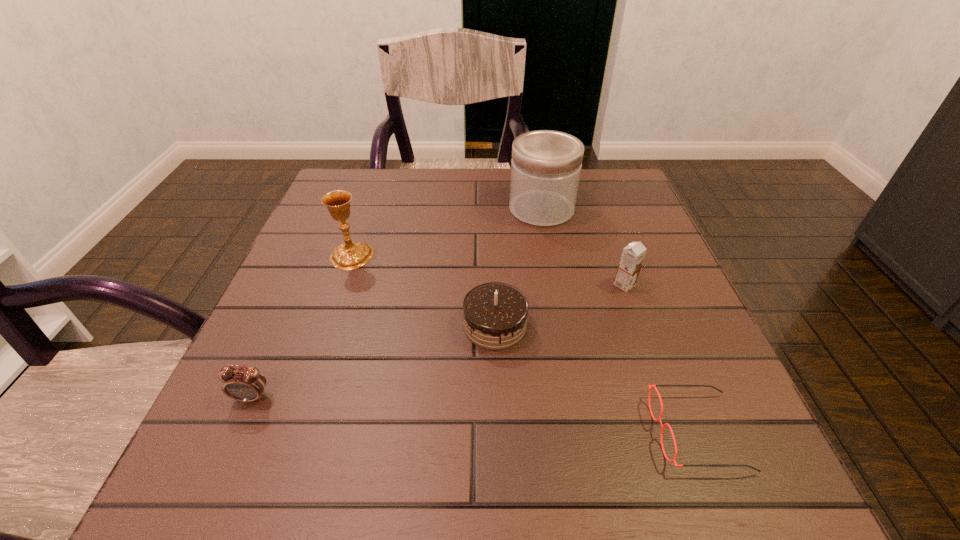
Find the location of a particular element. This screenshot has width=960, height=540. vacant space situated on the back of the fourth farthest object is located at coordinates (493, 282).

At what (x,y) coordinates should I click in order to perform the action: click on free space located 0.130m on the face of the leftmost object. Please return your answer as a coordinate pair (x, y). Looking at the image, I should click on (211, 491).

Find the location of a particular element. This screenshot has width=960, height=540. free space located 0.240m on the front-facing side of the shortest object is located at coordinates (493, 432).

Find the location of a particular element. This screenshot has height=540, width=960. vacant area situated 0.370m on the front-facing side of the shortest object is located at coordinates (405, 432).

This screenshot has height=540, width=960. Find the location of `vacant space located on the front-facing side of the shortest object`. vacant space located on the front-facing side of the shortest object is located at coordinates (575, 432).

You are a GUI agent. You are given a task and a screenshot of the screen. Output one action in this format:
    pyautogui.click(x=<x>, y=<y>)
    Task: Click on the object positioned at the far edge
    The height and width of the screenshot is (540, 960).
    Given the screenshot: What is the action you would take?
    tap(546, 165)

You are a GUI agent. You are given a task and a screenshot of the screen. Output one action in this format:
    pyautogui.click(x=<x>, y=<y>)
    Task: Click on the object that is positioned at the near edge
    The width and height of the screenshot is (960, 540).
    Given the screenshot: What is the action you would take?
    pyautogui.click(x=650, y=388)

Find the location of a particular element. The height and width of the screenshot is (540, 960). chalice at the left edge is located at coordinates click(350, 255).

Find the location of a particular element. This screenshot has height=540, width=960. alarm clock that is positioned at the left edge is located at coordinates (246, 384).

Where is `chocolate milk that is at the right edge`? This screenshot has width=960, height=540. chocolate milk that is at the right edge is located at coordinates (632, 256).